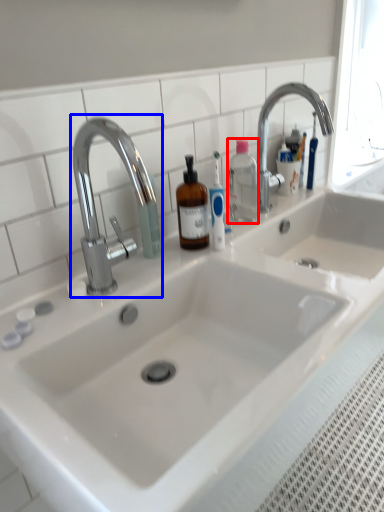
Question: Which point is further to the camera, bottle (highlighted by a red box) or tap (highlighted by a blue box)?

Choices:
 (A) bottle
 (B) tap

Answer: (A)